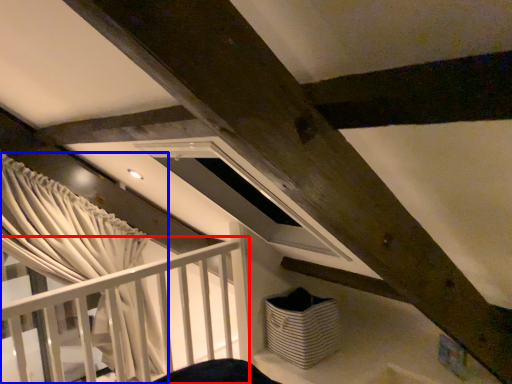
Question: Which object appears farthest to the camera in this image, rail (highlighted by a red box) or curtain (highlighted by a blue box)?

Choices:
 (A) rail
 (B) curtain

Answer: (B)